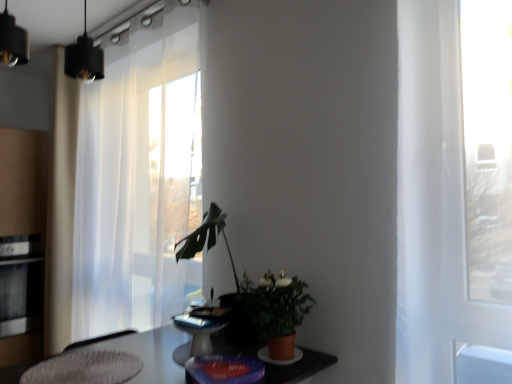
Question: Can you confirm if stainless steel oven at left is smaller than matte terracotta pot at center?

Choices:
 (A) yes
 (B) no

Answer: (B)

Question: Considering the relative positions of stainless steel oven at left and matte terracotta pot at center in the image provided, is stainless steel oven at left to the right of matte terracotta pot at center from the viewer's perspective?

Choices:
 (A) no
 (B) yes

Answer: (A)

Question: Is stainless steel oven at left looking in the opposite direction of matte terracotta pot at center?

Choices:
 (A) yes
 (B) no

Answer: (B)

Question: Can you confirm if stainless steel oven at left is positioned to the left of matte terracotta pot at center?

Choices:
 (A) no
 (B) yes

Answer: (B)

Question: From a real-world perspective, is stainless steel oven at left located beneath matte terracotta pot at center?

Choices:
 (A) yes
 (B) no

Answer: (A)

Question: Considering their positions, is stainless steel oven at left located in front of or behind white sheer curtain at left?

Choices:
 (A) front
 (B) behind

Answer: (B)

Question: Does point (7, 317) appear closer or farther from the camera than point (161, 31)?

Choices:
 (A) closer
 (B) farther

Answer: (B)

Question: From the image's perspective, is stainless steel oven at left positioned above or below white sheer curtain at left?

Choices:
 (A) below
 (B) above

Answer: (A)

Question: From their relative heights in the image, would you say stainless steel oven at left is taller or shorter than white sheer curtain at left?

Choices:
 (A) tall
 (B) short

Answer: (B)

Question: Considering the positions of matte terracotta pot at center and white sheer curtain at left in the image, is matte terracotta pot at center bigger or smaller than white sheer curtain at left?

Choices:
 (A) big
 (B) small

Answer: (B)

Question: From a real-world perspective, relative to white sheer curtain at left, is matte terracotta pot at center vertically above or below?

Choices:
 (A) above
 (B) below

Answer: (B)

Question: Is point (249, 309) positioned closer to the camera than point (88, 225)?

Choices:
 (A) farther
 (B) closer

Answer: (B)

Question: Which is correct: matte terracotta pot at center is inside white sheer curtain at left, or outside of it?

Choices:
 (A) inside
 (B) outside

Answer: (B)

Question: In terms of width, does stainless steel oven at left look wider or thinner when compared to textured gray rug at lower left?

Choices:
 (A) wide
 (B) thin

Answer: (A)

Question: Is stainless steel oven at left to the left or to the right of textured gray rug at lower left in the image?

Choices:
 (A) left
 (B) right

Answer: (A)